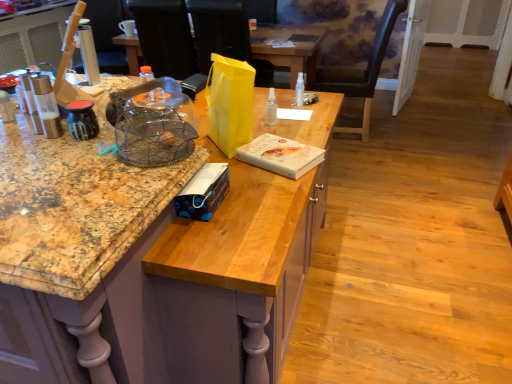
Describe the element at coordinates (230, 32) in the screenshot. I see `yellow paper bag at center, the 1th armchair when ordered from right to left` at that location.

In order to face yellow paper bag at center, the 3th armchair in the left-to-right sequence, should I rotate leftwards or rightwards?

You should look left and rotate roughly 3.240 degrees.

At what (x,y) coordinates should I click in order to perform the action: click on black matte laptop at center. Please return your answer as a coordinate pair (x, y). This screenshot has width=512, height=384. Looking at the image, I should click on (303, 38).

Find the location of a particular element. The image size is (512, 384). black leather chair at upper right is located at coordinates (361, 70).

You are a GUI agent. You are given a task and a screenshot of the screen. Output one action in this format:
    pyautogui.click(x=<x>, y=<y>)
    Task: Click on the transparent plastic bottle at center, the 2th bottle viewed from the right
    This screenshot has height=384, width=512.
    Given the screenshot: What is the action you would take?
    pyautogui.click(x=271, y=109)

Identify the location of wire mesh birdcage at center. (153, 124).

How different are the orientations of transparent plastic bottle at center, arranged as the second bottle when viewed from the back, and white plastic spray bottle at center, arranged as the first bottle when viewed from the back, in degrees?

There is a 0.00469-degree angle between the facing directions of transparent plastic bottle at center, arranged as the second bottle when viewed from the back, and white plastic spray bottle at center, arranged as the first bottle when viewed from the back.

Is transparent plastic bottle at center, the first bottle from the left, to the left or to the right of white plastic spray bottle at center, arranged as the first bottle when viewed from the back, in the image?

From the image, it's evident that transparent plastic bottle at center, the first bottle from the left, is to the left of white plastic spray bottle at center, arranged as the first bottle when viewed from the back.

Which object is wider, transparent plastic bottle at center, marked as the 1th bottle in a front-to-back arrangement, or white plastic spray bottle at center, acting as the second bottle starting from the front?

transparent plastic bottle at center, marked as the 1th bottle in a front-to-back arrangement.

Can you confirm if wire mesh birdcage at center is positioned to the right of black leather armchair at upper left, the second armchair positioned from the right?

Correct, you'll find wire mesh birdcage at center to the right of black leather armchair at upper left, the second armchair positioned from the right.

Is wire mesh birdcage at center aimed at black leather armchair at upper left, the second armchair positioned from the left?

No, wire mesh birdcage at center is not turned towards black leather armchair at upper left, the second armchair positioned from the left.

Is wire mesh birdcage at center in front of or behind black leather armchair at upper left, the second armchair positioned from the right, in the image?

Clearly, wire mesh birdcage at center is in front of black leather armchair at upper left, the second armchair positioned from the right.

Is transparent plastic bottle at center, the 2th bottle viewed from the right, positioned with its back to white matte book at center, the first box from the right?

No, transparent plastic bottle at center, the 2th bottle viewed from the right, is not facing the opposite direction of white matte book at center, the first box from the right.

How different are the orientations of transparent plastic bottle at center, the first bottle from the left, and white matte book at center, the first box from the right, in degrees?

The facing directions of transparent plastic bottle at center, the first bottle from the left, and white matte book at center, the first box from the right, are 113 degrees apart.

Considering the positions of objects transparent plastic bottle at center, the 2th bottle viewed from the right, and white matte book at center, arranged as the 2th box when viewed from the front, in the image provided, who is more to the right, transparent plastic bottle at center, the 2th bottle viewed from the right, or white matte book at center, arranged as the 2th box when viewed from the front,?

white matte book at center, arranged as the 2th box when viewed from the front, is more to the right.

Considering the points (265, 122) and (305, 169), which point is in front, point (265, 122) or point (305, 169)?

The point (305, 169) is more forward.

Are black leather chair at upper right and transparent plastic bottle at center, marked as the 1th bottle in a front-to-back arrangement, located far from each other?

black leather chair at upper right is far away from transparent plastic bottle at center, marked as the 1th bottle in a front-to-back arrangement.

Which of these two, black leather chair at upper right or transparent plastic bottle at center, marked as the 1th bottle in a front-to-back arrangement, stands taller?

Standing taller between the two is black leather chair at upper right.

Considering the relative sizes of black leather armchair at upper left, the second armchair positioned from the right, and metallic glass salt shaker at left, which is counted as the 1th kitchen appliance, starting from the left, in the image provided, is black leather armchair at upper left, the second armchair positioned from the right, shorter than metallic glass salt shaker at left, which is counted as the 1th kitchen appliance, starting from the left,?

No, black leather armchair at upper left, the second armchair positioned from the right, is not shorter than metallic glass salt shaker at left, which is counted as the 1th kitchen appliance, starting from the left.

Is black leather armchair at upper left, the second armchair positioned from the right, inside the boundaries of metallic glass salt shaker at left, which is counted as the 1th kitchen appliance, starting from the left, or outside?

black leather armchair at upper left, the second armchair positioned from the right, is located beyond the bounds of metallic glass salt shaker at left, which is counted as the 1th kitchen appliance, starting from the left.

From a real-world perspective, is black leather armchair at upper left, the second armchair positioned from the left, physically below metallic glass salt shaker at left, which is counted as the 1th kitchen appliance, starting from the left?

Yes, from a real-world perspective, black leather armchair at upper left, the second armchair positioned from the left, is under metallic glass salt shaker at left, which is counted as the 1th kitchen appliance, starting from the left.

Is black leather armchair at upper left, the second armchair positioned from the right, to the left of metallic glass salt shaker at left, which is counted as the 1th kitchen appliance, starting from the left, from the viewer's perspective?

No, black leather armchair at upper left, the second armchair positioned from the right, is not to the left of metallic glass salt shaker at left, which is counted as the 1th kitchen appliance, starting from the left.

Which is more to the left, white matte book at center, the 2th box from the left, or wooden cabinet at center?

wooden cabinet at center.

Does white matte book at center, the 2th box from the left, have a lesser width compared to wooden cabinet at center?

Correct, the width of white matte book at center, the 2th box from the left, is less than that of wooden cabinet at center.

Is white matte book at center, arranged as the 2th box when viewed from the front, aimed at wooden cabinet at center?

Yes, white matte book at center, arranged as the 2th box when viewed from the front, is turned towards wooden cabinet at center.

Does point (256, 155) lie behind point (180, 261)?

Yes.

What's the angular difference between matte black kettle at left, the 1th kitchen appliance when ordered from right to left, and white matte book at center, arranged as the 2th box when viewed from the front,'s facing directions?

The facing directions of matte black kettle at left, the 1th kitchen appliance when ordered from right to left, and white matte book at center, arranged as the 2th box when viewed from the front, are 114 degrees apart.

There is a white matte book at center, the first box from the right. Where is `the 1st kitchen appliance above it (from a real-world perspective)`? The width and height of the screenshot is (512, 384). the 1st kitchen appliance above it (from a real-world perspective) is located at coordinates (82, 120).

Between matte black kettle at left, the 2th kitchen appliance when ordered from left to right, and white matte book at center, the 1th box in the back-to-front sequence, which one has less height?

Standing shorter between the two is white matte book at center, the 1th box in the back-to-front sequence.

Is point (87, 100) closer to camera compared to point (318, 158)?

Yes, it is in front of point (318, 158).

Find the location of `bottle in front of the white plastic spray bottle at center, which is the 1th bottle from right to left`. bottle in front of the white plastic spray bottle at center, which is the 1th bottle from right to left is located at coordinates (271, 109).

The height and width of the screenshot is (384, 512). Identify the location of the 2nd armchair behind the wire mesh birdcage at center, starting your count from the anchor. [165, 37].

Consider the image. From the image, which object appears to be nearer to black leather armchair at upper left, the second armchair positioned from the left, black leather chair at upper right or wire mesh birdcage at center?

black leather chair at upper right is closer to black leather armchair at upper left, the second armchair positioned from the left.

Looking at the image, which one is located further to yellow paper bag at center, the 1th armchair when ordered from right to left, black matte laptop at center or matte black kettle at left, the 1th kitchen appliance when ordered from right to left?

matte black kettle at left, the 1th kitchen appliance when ordered from right to left, is positioned further to the anchor yellow paper bag at center, the 1th armchair when ordered from right to left.

From the image, which object appears to be farther from black leather chair at upper right, transparent plastic bottle at center, arranged as the second bottle when viewed from the back, or wire mesh birdcage at center?

wire mesh birdcage at center.

When comparing their distances from white matte coffee cup at upper center, does transparent plastic bottle at center, arranged as the second bottle when viewed from the back, or wire mesh birdcage at center seem closer?

transparent plastic bottle at center, arranged as the second bottle when viewed from the back, is closer to white matte coffee cup at upper center.

Considering their positions, is wire mesh birdcage at center positioned closer to black leather chair at upper right than yellow paper bag at center, the 3th armchair in the left-to-right sequence?

Among the two, yellow paper bag at center, the 3th armchair in the left-to-right sequence, is located nearer to black leather chair at upper right.

Estimate the real-world distances between objects in this image. Which object is closer to metallic glass salt shaker at left, which is counted as the second kitchen appliance, starting from the right, wooden cabinet at center or white plastic spray bottle at center, acting as the second bottle starting from the front?

wooden cabinet at center lies closer to metallic glass salt shaker at left, which is counted as the second kitchen appliance, starting from the right, than the other object.

When comparing their distances from wire mesh birdcage at center, does white matte book at center, arranged as the 2th box when viewed from the front, or metallic glass salt shaker at left, which is counted as the second kitchen appliance, starting from the right, seem closer?

metallic glass salt shaker at left, which is counted as the second kitchen appliance, starting from the right.

When comparing their distances from transparent plastic bottle at center, marked as the 1th bottle in a front-to-back arrangement, does black leather armchair at upper left, the second armchair positioned from the right, or metallic glass salt shaker at left, which is counted as the 1th kitchen appliance, starting from the left, seem further?

The object further to transparent plastic bottle at center, marked as the 1th bottle in a front-to-back arrangement, is black leather armchair at upper left, the second armchair positioned from the right.

You are a GUI agent. You are given a task and a screenshot of the screen. Output one action in this format:
    pyautogui.click(x=<x>, y=<y>)
    Task: Click on the box between blue matte box at center, which appears as the second box when viewed from the right, and black matte laptop at center from front to back
    The image size is (512, 384).
    Given the screenshot: What is the action you would take?
    pyautogui.click(x=280, y=155)

Identify the location of bottle between matte black kettle at left, the 1th kitchen appliance when ordered from right to left, and white plastic spray bottle at center, acting as the second bottle starting from the left, from left to right. Image resolution: width=512 pixels, height=384 pixels. (271, 109).

Where is `box between blue matte box at center, which is the 2th box from back to front, and white plastic spray bottle at center, acting as the second bottle starting from the front, along the z-axis`? box between blue matte box at center, which is the 2th box from back to front, and white plastic spray bottle at center, acting as the second bottle starting from the front, along the z-axis is located at coordinates (280, 155).

Image resolution: width=512 pixels, height=384 pixels. Find the location of `laptop between wooden chair at upper left, marked as the 1th armchair in a left-to-right arrangement, and black leather chair at upper right, in the horizontal direction`. laptop between wooden chair at upper left, marked as the 1th armchair in a left-to-right arrangement, and black leather chair at upper right, in the horizontal direction is located at coordinates (303, 38).